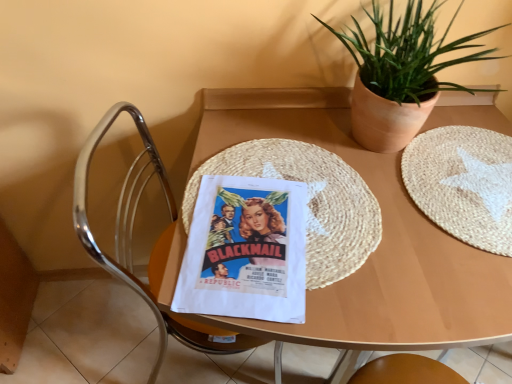
Question: Relative to wooden placemat at center, is white woven placemat at center right in front or behind?

Choices:
 (A) behind
 (B) front

Answer: (A)

Question: From their relative heights in the image, would you say white woven placemat at center right is taller or shorter than wooden placemat at center?

Choices:
 (A) short
 (B) tall

Answer: (A)

Question: Based on their relative distances, which object is nearer to the white woven placemat at center right?

Choices:
 (A) woven straw mat at center
 (B) polished chrome chair at left
 (C) matte paper poster at center
 (D) green leafy plant in clay pot at upper right
 (E) wooden placemat at center

Answer: (E)

Question: Which object is the closest to the polished chrome chair at left?

Choices:
 (A) matte paper poster at center
 (B) wooden placemat at center
 (C) green leafy plant in clay pot at upper right
 (D) woven straw mat at center
 (E) white woven placemat at center right

Answer: (A)